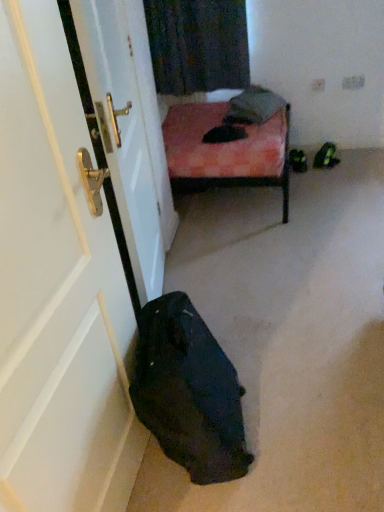
Question: Is velvet pink cushion at upper center positioned in front of matte white door at left?

Choices:
 (A) yes
 (B) no

Answer: (B)

Question: Is velvet pink cushion at upper center bigger than matte white door at left?

Choices:
 (A) yes
 (B) no

Answer: (B)

Question: Is velvet pink cushion at upper center beside matte white door at left?

Choices:
 (A) no
 (B) yes

Answer: (A)

Question: Is velvet pink cushion at upper center oriented towards matte white door at left?

Choices:
 (A) no
 (B) yes

Answer: (A)

Question: Considering the relative sizes of velvet pink cushion at upper center and matte white door at left in the image provided, is velvet pink cushion at upper center shorter than matte white door at left?

Choices:
 (A) no
 (B) yes

Answer: (B)

Question: Is velvet pink cushion at upper center smaller than matte white door at left?

Choices:
 (A) yes
 (B) no

Answer: (A)

Question: Does matte white door at left lie in front of velvet pink cushion at upper center?

Choices:
 (A) no
 (B) yes

Answer: (B)

Question: From the image's perspective, is matte white door at left above velvet pink cushion at upper center?

Choices:
 (A) no
 (B) yes

Answer: (A)

Question: Is matte white door at left not within velvet pink cushion at upper center?

Choices:
 (A) no
 (B) yes

Answer: (B)

Question: Can you confirm if matte white door at left is shorter than velvet pink cushion at upper center?

Choices:
 (A) yes
 (B) no

Answer: (B)

Question: Is matte white door at left further to camera compared to velvet pink cushion at upper center?

Choices:
 (A) yes
 (B) no

Answer: (B)

Question: Is matte white door at left taller than velvet pink cushion at upper center?

Choices:
 (A) yes
 (B) no

Answer: (A)

Question: From their relative heights in the image, would you say matte white door at left is taller or shorter than velvet pink cushion at upper center?

Choices:
 (A) short
 (B) tall

Answer: (B)